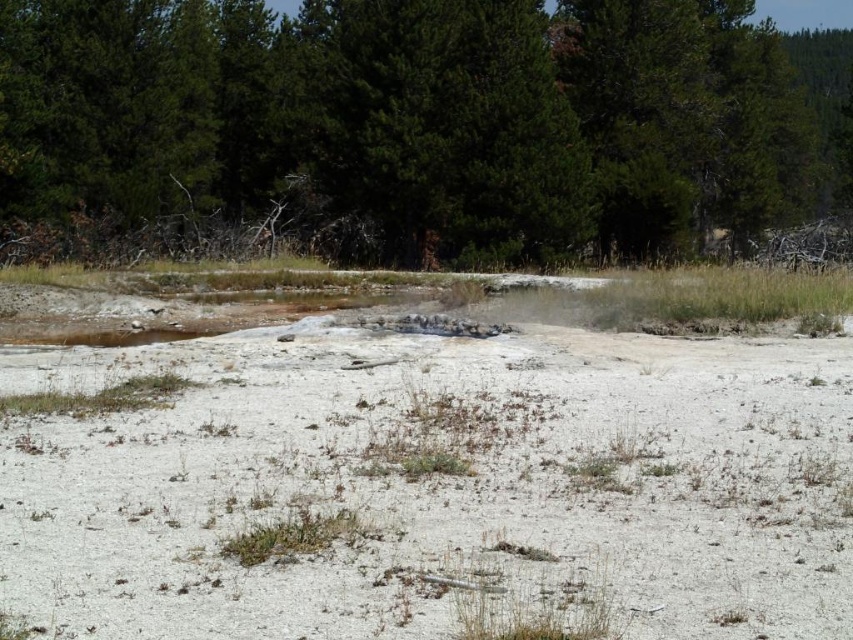
You are a hiker who wants to set up a tent in the image. You see the white sandy dirt at center and the green textured tree at upper center. Which location would be better for setting up your tent to avoid getting wet if it rains?

The white sandy dirt at center is positioned under the green textured tree at upper center. Since the tree can provide shelter from rain, setting up the tent under the tree might keep it drier. However, the sandy dirt at the center is a flat area suitable for tent setup. Consider both factors based on your preference for shelter versus flat ground.

You are standing at the edge of the dry sandy terrain in the image. There is a point marked at coordinates (437, 484) which indicates white sandy dirt at center. If you walk straight towards the dense clusters of evergreen trees in the background, will you pass through the white sandy dirt at center first?

Answer: Yes, the point marked at (437, 484) indicating white sandy dirt at center is located in the middle ground between the foreground and the background. Walking straight towards the dense clusters of evergreen trees in the background, you would first pass through the white sandy dirt at center before reaching the trees.

You are an explorer trying to cross the white sandy dirt at center and reach the green textured tree at upper center. Based on the scene, which path would be more stable for walking?

The white sandy dirt at center is thinner than the green textured tree at upper center, so the green textured tree at upper center would provide a more stable path for walking.